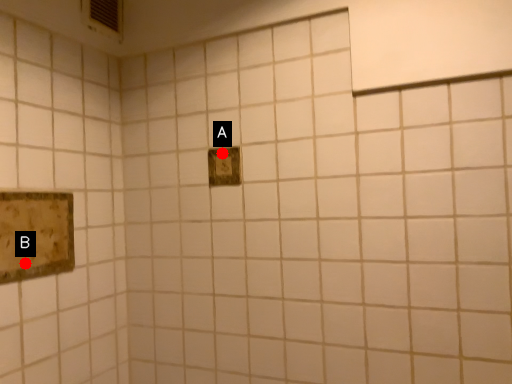
Question: Two points are circled on the image, labeled by A and B beside each circle. Which point appears closest to the camera in this image?

Choices:
 (A) A is closer
 (B) B is closer

Answer: (B)